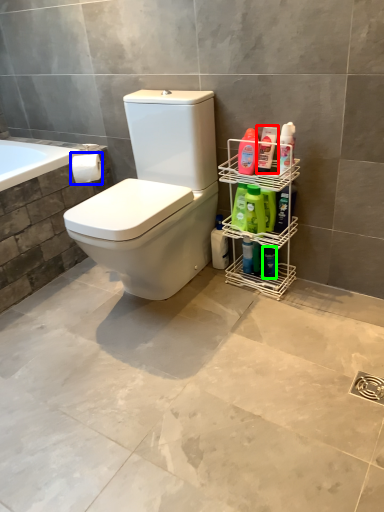
Question: Which object is positioned closest to cleaning product (highlighted by a red box)? Select from toilet paper (highlighted by a blue box) and toiletry (highlighted by a green box).

Choices:
 (A) toilet paper
 (B) toiletry

Answer: (B)